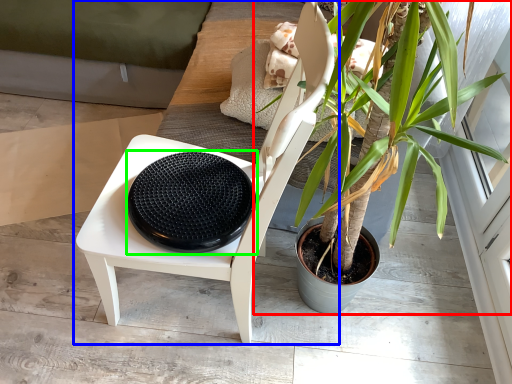
Question: Estimate the real-world distances between objects in this image. Which object is farther from houseplant (highlighted by a red box), chair (highlighted by a blue box) or footrest (highlighted by a green box)?

Choices:
 (A) chair
 (B) footrest

Answer: (B)